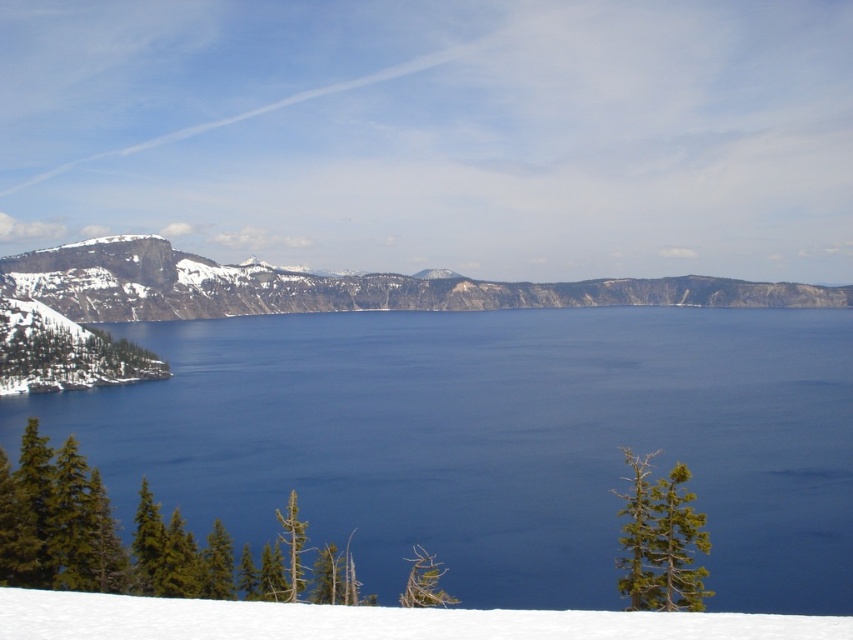
Question: Which point is closer to the camera taking this photo?

Choices:
 (A) (837, 531)
 (B) (500, 628)

Answer: (B)

Question: Can you confirm if deep blue water at center is positioned above dark gray rocky cliff at center?

Choices:
 (A) no
 (B) yes

Answer: (A)

Question: Based on their relative distances, which object is nearer to the dark gray rocky cliff at center?

Choices:
 (A) deep blue water at center
 (B) green matte pine at lower center
 (C) green matte tree at upper right
 (D) white snow at lower center

Answer: (A)

Question: Which of these objects is positioned closest to the green matte tree at upper right?

Choices:
 (A) green matte pine at lower center
 (B) dark gray rocky cliff at center
 (C) white snow at lower center
 (D) deep blue water at center

Answer: (C)

Question: Considering the relative positions of dark gray rocky cliff at center and green matte pine at lower center in the image provided, where is dark gray rocky cliff at center located with respect to green matte pine at lower center?

Choices:
 (A) above
 (B) below

Answer: (A)

Question: Can you confirm if deep blue water at center is positioned below white snow at lower center?

Choices:
 (A) yes
 (B) no

Answer: (B)